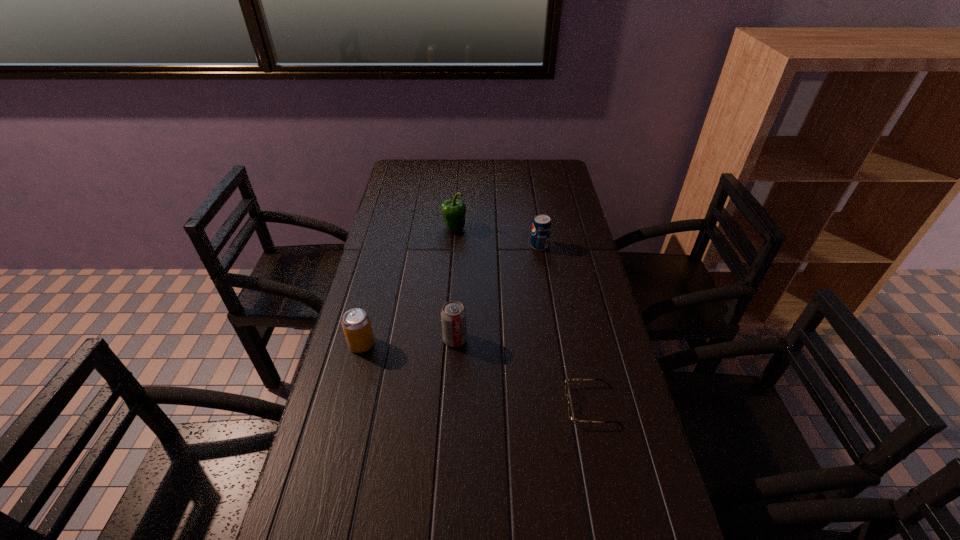
The height and width of the screenshot is (540, 960). Identify the location of free spot between the rightmost pop (soda) and the second pop (soda) from left to right. (497, 293).

Identify the location of vacant space that's between the bell pepper and the leftmost object. This screenshot has width=960, height=540. (408, 286).

Locate an element on the screen. This screenshot has width=960, height=540. object that is the second closest one to the nearest object is located at coordinates (356, 324).

Where is `object that stands as the third closest to the farthest pop (soda)`? Image resolution: width=960 pixels, height=540 pixels. object that stands as the third closest to the farthest pop (soda) is located at coordinates (570, 409).

Find the location of a particular element. This screenshot has width=960, height=540. pop (soda) that is the closest one to the farthest object is located at coordinates (541, 227).

Where is `pop (soda) identified as the second closest to the second pop (soda) from right to left`? The width and height of the screenshot is (960, 540). pop (soda) identified as the second closest to the second pop (soda) from right to left is located at coordinates (541, 227).

The height and width of the screenshot is (540, 960). In order to click on vacant position in the image that satisfies the following two spatial constraints: 1. on the back side of the second farthest object; 2. on the left side of the second pop (soda) from left to right in this screenshot , I will do `click(460, 246)`.

Where is `vacant space that satisfies the following two spatial constraints: 1. on the back side of the bell pepper; 2. on the right side of the leftmost object`? vacant space that satisfies the following two spatial constraints: 1. on the back side of the bell pepper; 2. on the right side of the leftmost object is located at coordinates (392, 228).